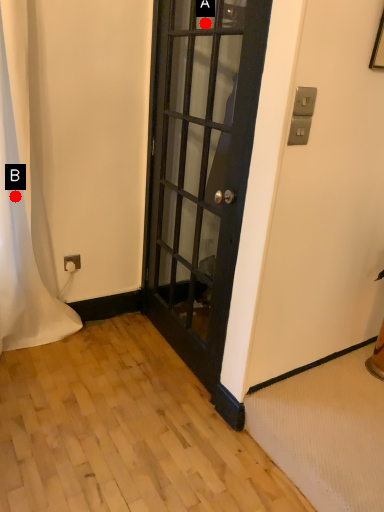
Question: Two points are circled on the image, labeled by A and B beside each circle. Which point is closer to the camera?

Choices:
 (A) A is closer
 (B) B is closer

Answer: (B)